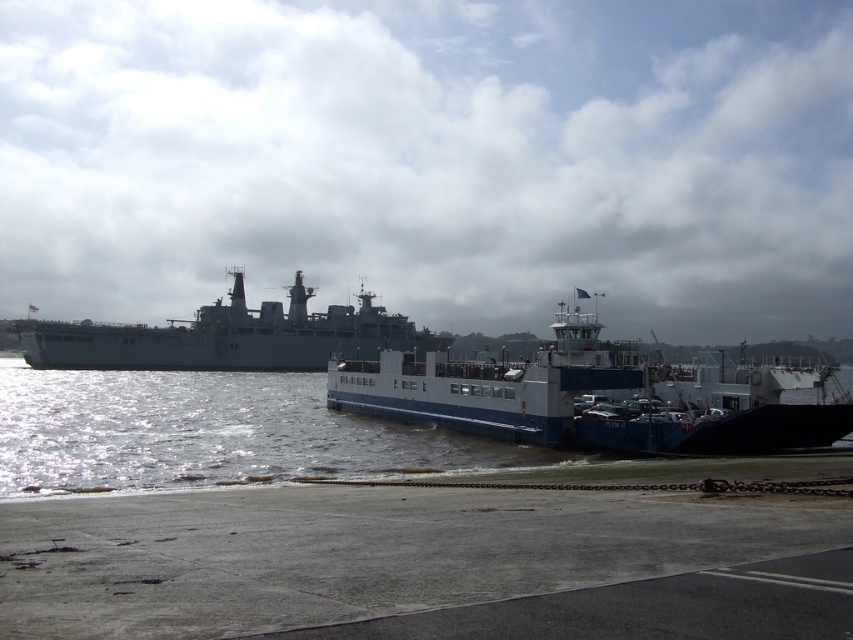
Can you confirm if glistening water at lower left is bigger than gray matte ship at center?

No.

Measure the distance between point (233, 403) and camera.

Point (233, 403) is 72.10 meters from camera.

Find the location of `glistening water at lower left`. glistening water at lower left is located at coordinates (210, 433).

Which is above, glistening water at lower left or blue matte ferry at center?

Positioned higher is blue matte ferry at center.

Consider the image. Which of these two, glistening water at lower left or blue matte ferry at center, stands shorter?

With less height is glistening water at lower left.

What are the coordinates of `glistening water at lower left` in the screenshot? It's located at (210, 433).

Where is `glistening water at lower left`? This screenshot has width=853, height=640. glistening water at lower left is located at coordinates (210, 433).

Based on the photo, which is below, blue matte ferry at center or gray matte ship at center?

gray matte ship at center is below.

Is blue matte ferry at center bigger than gray matte ship at center?

Incorrect, blue matte ferry at center is not larger than gray matte ship at center.

Locate an element on the screen. The height and width of the screenshot is (640, 853). blue matte ferry at center is located at coordinates (579, 397).

In order to click on blue matte ferry at center in this screenshot , I will do `click(579, 397)`.